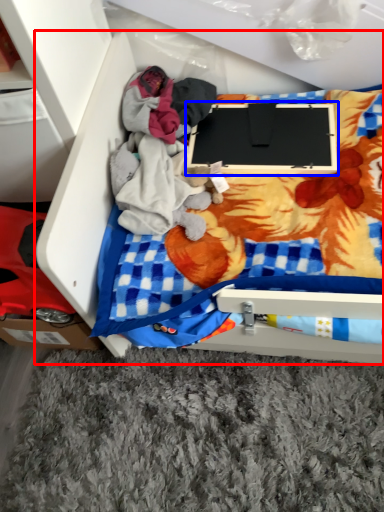
Question: Among these objects, which one is nearest to the camera, furniture (highlighted by a red box) or laptop (highlighted by a blue box)?

Choices:
 (A) furniture
 (B) laptop

Answer: (A)